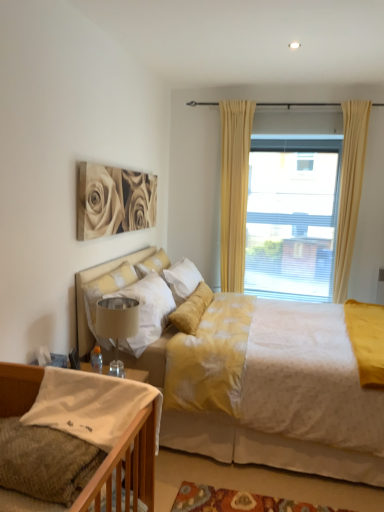
You are a GUI agent. You are given a task and a screenshot of the screen. Output one action in this format:
    pyautogui.click(x=<x>, y=<y>)
    Task: Click on the vacant location below matte beige roses at upper left (from a real-world perspective)
    
    Given the screenshot: What is the action you would take?
    pyautogui.click(x=115, y=252)